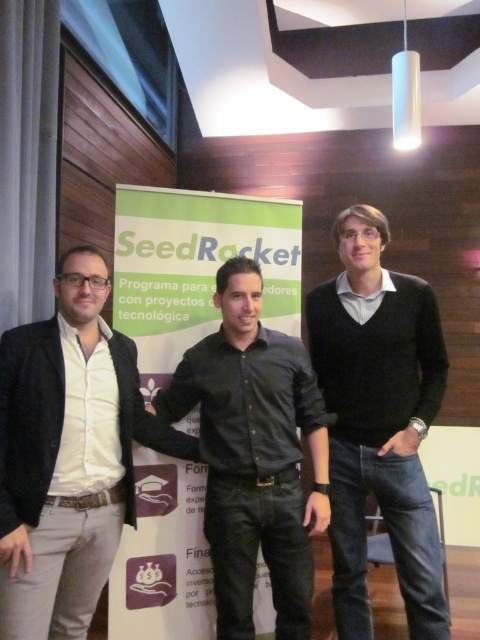
Consider the image. You are organizing a photo shoot and need to ensure that the white matte shirt at left and the black sweater at center are visible in the final image. Given their sizes, which one should you focus on to ensure both are clearly captured?

The white matte shirt at left is larger in size than the black sweater at center, so focusing on the white matte shirt at left will help ensure both are clearly visible in the photo.

You are an event photographer at the SeedRocket program event. You need to capture a clear photo of the black sweater at center while ensuring the white matte shirt at left is visible in the background. Is this possible given their positions?

The white matte shirt at left is in front of the black sweater at center, so taking a photo focused on the black sweater at center would have the white matte shirt at left overlapping it, making the black sweater at center less visible. To have the black sweater at center in the foreground and the white matte shirt at left in the background, their positions need to be reversed.